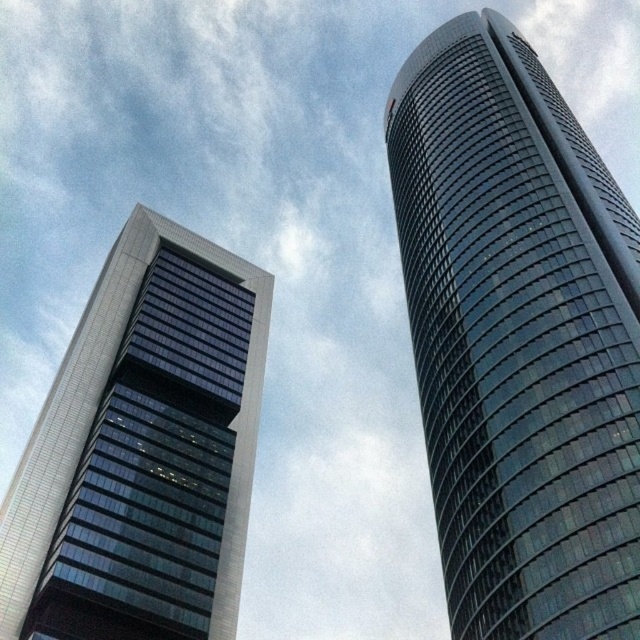
In the scene shown: You are standing in front of two skyscrapers. The shiny glass skyscraper at right and the matte glass skyscraper at left. Which one would you need to walk towards first if you want to reach the one that is closer to you?

You should walk towards the shiny glass skyscraper at right first because it is closer to the viewer than the matte glass skyscraper at left.

You are an architect evaluating two skyscrapers in the city. You see the shiny glass skyscraper at right and the matte glass skyscraper at left. Which one has a greater overall height?

The shiny glass skyscraper at right is larger in size than the matte glass skyscraper at left, so it has a greater overall height.

You are standing at the center of the image and want to locate the shiny glass skyscraper at right. What are its coordinates?

The coordinates of the shiny glass skyscraper at right are at point (518, 339).